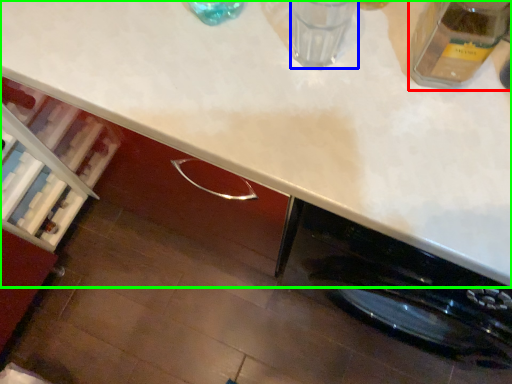
Question: Considering the real-world distances, which object is farthest from glass jar (highlighted by a red box)? water (highlighted by a blue box) or countertop (highlighted by a green box)?

Choices:
 (A) water
 (B) countertop

Answer: (B)